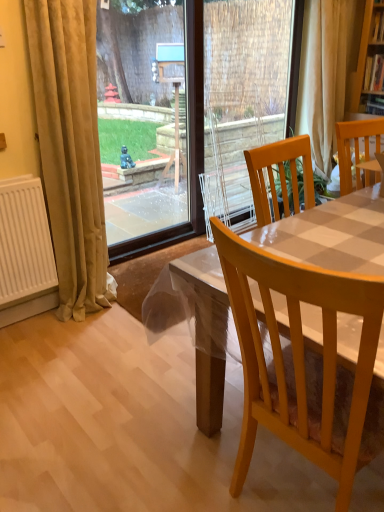
Question: Is beige fabric curtain at upper right, positioned as the 2th curtain in left-to-right order, spatially inside light brown wooden chair at center, which ranks as the 1th chair in front-to-back order, or outside of it?

Choices:
 (A) inside
 (B) outside

Answer: (B)

Question: Considering their positions, is beige fabric curtain at upper right, marked as the 1th curtain in a back-to-front arrangement, located in front of or behind light brown wooden chair at center, the second chair when ordered from right to left?

Choices:
 (A) behind
 (B) front

Answer: (A)

Question: Based on their relative distances, which object is farther from the clear plastic screen door at center?

Choices:
 (A) beige velvet curtain at left, the second curtain viewed from the top
 (B) beige fabric curtain at upper right, the first curtain when ordered from top to bottom
 (C) wooden chair at right, the 1th chair when ordered from back to front
 (D) transparent glass door at upper left
 (E) light brown wooden chair at center, the second chair when ordered from top to bottom

Answer: (D)

Question: Considering the real-world distances, which object is farthest from the beige fabric curtain at upper right, marked as the 1th curtain in a back-to-front arrangement?

Choices:
 (A) transparent glass door at upper left
 (B) wooden chair at right, the 1th chair when ordered from back to front
 (C) beige velvet curtain at left, which appears as the first curtain when viewed from the front
 (D) light brown wooden chair at center, which ranks as the 1th chair in front-to-back order
 (E) clear plastic screen door at center

Answer: (A)